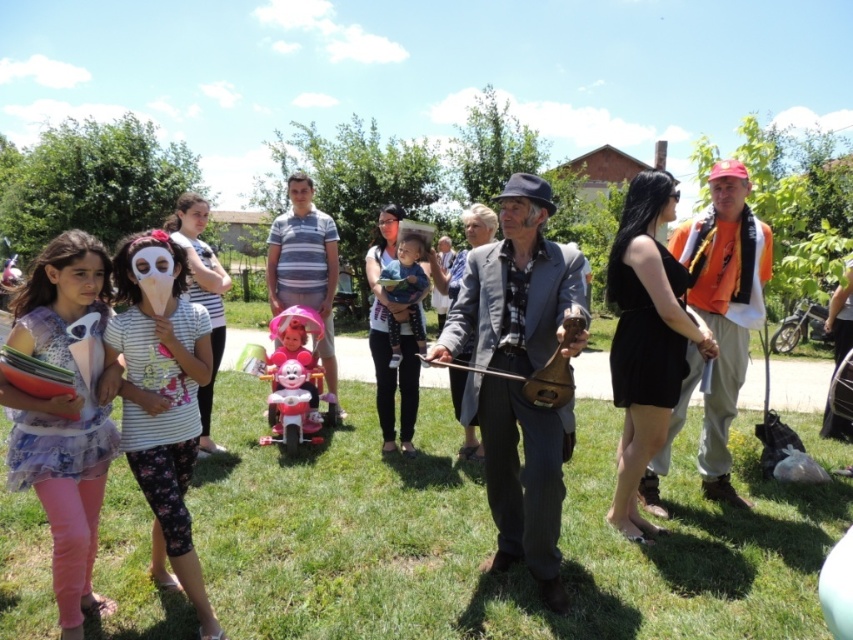
Question: Which of the following is the farthest from the observer?

Choices:
 (A) (328, 362)
 (B) (756, 326)
 (C) (497, 196)
 (D) (607, 624)

Answer: (A)

Question: Does green grass at center have a lesser width compared to matte gray suit at center?

Choices:
 (A) no
 (B) yes

Answer: (A)

Question: Is orange fabric shirt at right bigger than pink plastic toy at center?

Choices:
 (A) no
 (B) yes

Answer: (B)

Question: Among these points, which one is farthest from the camera?

Choices:
 (A) (415, 316)
 (B) (543, 468)
 (C) (741, 508)

Answer: (A)

Question: Does green grass at center have a greater width compared to striped cotton shirt at center?

Choices:
 (A) no
 (B) yes

Answer: (B)

Question: Which point is closer to the camera?

Choices:
 (A) light blue fabric baby at center
 (B) green grass at center
 (C) striped cotton shirt at center
 (D) matte gray suit at center

Answer: (B)